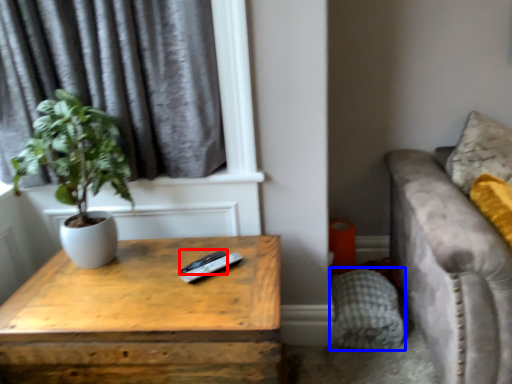
Question: Among these objects, which one is farthest to the camera, remote (highlighted by a red box) or pillow (highlighted by a blue box)?

Choices:
 (A) remote
 (B) pillow

Answer: (B)